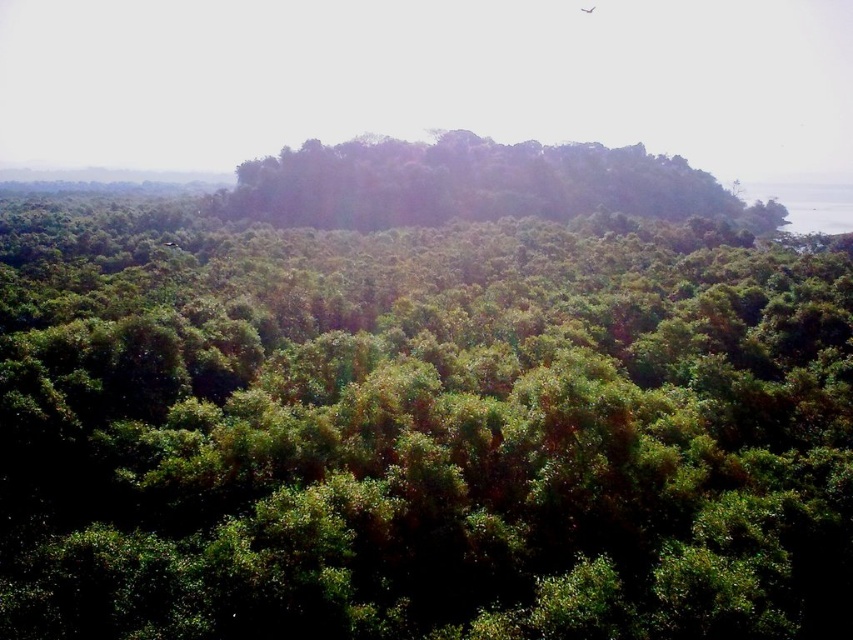
You are standing in the middle of the forest and see the green leafy forest at center and the green leafy trees at center. Which one is closer to you?

The green leafy forest at center is closer to the viewer than the green leafy trees at center.

In the scene shown: You are a hiker standing at the edge of the green leafy forest at center and the green leafy trees at center. Which one is closer to you?

The green leafy forest at center is positioned under the green leafy trees at center, so the green leafy trees at center are closer to you.